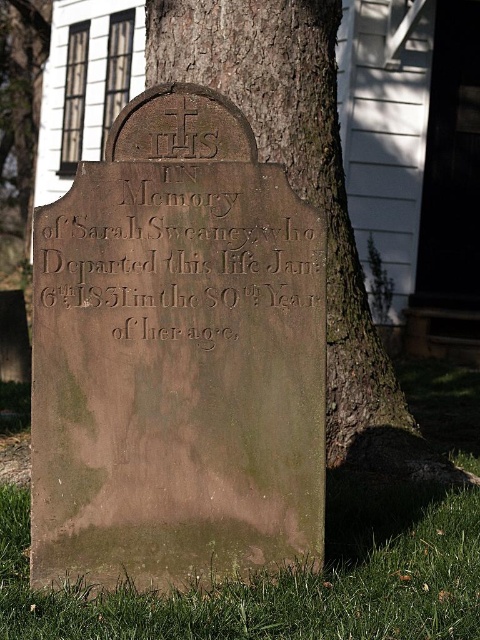
Question: Can you confirm if brown stone inscription at center is positioned to the left of green grass at lower center?

Choices:
 (A) yes
 (B) no

Answer: (A)

Question: Considering the real-world distances, which object is closest to the green grass at lower center?

Choices:
 (A) brown stone inscription at center
 (B) brown rough bark at center

Answer: (A)

Question: Which point is closer to the camera taking this photo?

Choices:
 (A) (406, 492)
 (B) (283, 13)
 (C) (225, 208)

Answer: (C)

Question: Is the position of brown stone inscription at center less distant than that of green grass at lower center?

Choices:
 (A) no
 (B) yes

Answer: (A)

Question: Is green grass at lower center below brown rough bark at center?

Choices:
 (A) yes
 (B) no

Answer: (A)

Question: Among these objects, which one is farthest from the camera?

Choices:
 (A) brown rough bark at center
 (B) green grass at lower center

Answer: (A)